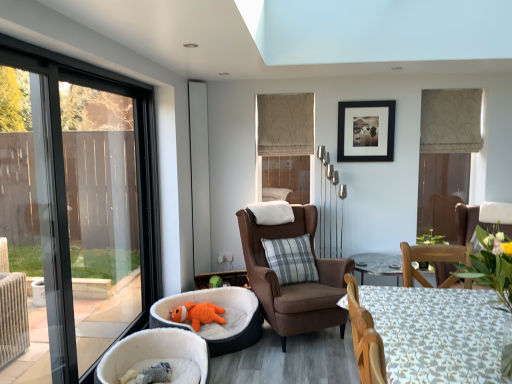
The width and height of the screenshot is (512, 384). I want to click on white plush pet bed at lower left, positioned as the 1th chair in left-to-right order, so click(x=157, y=355).

What do you see at coordinates (296, 283) in the screenshot? I see `brown fabric chair at center, placed as the 2th chair when sorted from front to back` at bounding box center [296, 283].

Measure the distance between plaid fabric pillow at center and camera.

The depth of plaid fabric pillow at center is 3.49 meters.

You are a GUI agent. You are given a task and a screenshot of the screen. Output one action in this format:
    pyautogui.click(x=<x>, y=<y>)
    Task: Click on the orange corduroy pet bed at lower left
    The height and width of the screenshot is (384, 512).
    Given the screenshot: What is the action you would take?
    pyautogui.click(x=221, y=315)

This screenshot has width=512, height=384. Identify the location of satin silver screen door at center. (199, 176).

What do you see at coordinates (366, 131) in the screenshot? I see `black matte picture frame at upper center` at bounding box center [366, 131].

Find the location of `orange plush toy at lower left`. orange plush toy at lower left is located at coordinates (198, 314).

What are the coordinates of `white plush pet bed at lower left, positioned as the 1th chair in left-to-right order` in the screenshot? It's located at (157, 355).

Is point (304, 216) closer to camera compared to point (262, 243)?

No, (304, 216) is further to viewer.

Which of these two, brown fabric chair at center, placed as the 2th chair when sorted from front to back, or plaid fabric pillow at center, is thinner?

plaid fabric pillow at center is thinner.

Can you confirm if brown fabric chair at center, which appears as the 1th chair when viewed from the back, is smaller than plaid fabric pillow at center?

Actually, brown fabric chair at center, which appears as the 1th chair when viewed from the back, might be larger than plaid fabric pillow at center.

Is satin silver screen door at center bigger than white plush pet bed at lower left, positioned as the 1th chair in left-to-right order?

Incorrect, satin silver screen door at center is not larger than white plush pet bed at lower left, positioned as the 1th chair in left-to-right order.

Is satin silver screen door at center thinner than white plush pet bed at lower left, placed as the 1th chair when sorted from front to back?

Indeed, satin silver screen door at center has a lesser width compared to white plush pet bed at lower left, placed as the 1th chair when sorted from front to back.

Is satin silver screen door at center looking in the opposite direction of white plush pet bed at lower left, which ranks as the 2th chair in back-to-front order?

No, satin silver screen door at center is not facing away from white plush pet bed at lower left, which ranks as the 2th chair in back-to-front order.

From the image's perspective, between satin silver screen door at center and white plush pet bed at lower left, placed as the 1th chair when sorted from front to back, who is located below?

From the image's view, white plush pet bed at lower left, placed as the 1th chair when sorted from front to back, is below.

Considering the sizes of objects orange corduroy pet bed at lower left and orange plush toy at lower left in the image provided, who is wider, orange corduroy pet bed at lower left or orange plush toy at lower left?

Wider between the two is orange corduroy pet bed at lower left.

Between point (253, 320) and point (192, 308), which one is positioned in front?

The point (253, 320) is in front.

Between orange corduroy pet bed at lower left and orange plush toy at lower left, which one has smaller size?

With smaller size is orange plush toy at lower left.

Does orange corduroy pet bed at lower left touch orange plush toy at lower left?

No.

Which is correct: plaid fabric pillow at center is inside orange plush toy at lower left, or outside of it?

plaid fabric pillow at center is not enclosed by orange plush toy at lower left.

Is point (306, 278) positioned before point (214, 319)?

That is False.

Between plaid fabric pillow at center and orange plush toy at lower left, which one appears on the right side from the viewer's perspective?

Positioned to the right is plaid fabric pillow at center.

From a real-world perspective, which object stands above the other?

plaid fabric pillow at center.

Is orange corduroy pet bed at lower left in front of or behind white plush pet bed at lower left, positioned as the 1th chair in left-to-right order, in the image?

orange corduroy pet bed at lower left is behind white plush pet bed at lower left, positioned as the 1th chair in left-to-right order.

Is point (252, 292) positioned before point (178, 376)?

No, (252, 292) is behind (178, 376).

What's the angular difference between orange corduroy pet bed at lower left and white plush pet bed at lower left, positioned as the 1th chair in left-to-right order,'s facing directions?

They differ by 45.9 degrees in their facing directions.

From a real-world perspective, is orange corduroy pet bed at lower left on white plush pet bed at lower left, which ranks as the 2th chair in back-to-front order?

Correct, in the physical world, orange corduroy pet bed at lower left is higher than white plush pet bed at lower left, which ranks as the 2th chair in back-to-front order.

From a real-world perspective, who is located higher, white plush pet bed at lower left, positioned as the 1th chair in left-to-right order, or orange corduroy pet bed at lower left?

orange corduroy pet bed at lower left, from a real-world perspective.

Can you tell me how much white plush pet bed at lower left, which ranks as the 2th chair in back-to-front order, and orange corduroy pet bed at lower left differ in facing direction?

white plush pet bed at lower left, which ranks as the 2th chair in back-to-front order, and orange corduroy pet bed at lower left are facing 45.9 degrees away from each other.

From the picture: Which object is positioned more to the right, white plush pet bed at lower left, positioned as the 1th chair in left-to-right order, or orange corduroy pet bed at lower left?

orange corduroy pet bed at lower left.

Identify the location of infant bed behind the white plush pet bed at lower left, the second chair when ordered from right to left. Image resolution: width=512 pixels, height=384 pixels. (221, 315).

In the scene shown: From the image's perspective, would you say orange plush toy at lower left is shown under white plush pet bed at lower left, which ranks as the 2th chair in back-to-front order?

No, from the image's perspective, orange plush toy at lower left is not beneath white plush pet bed at lower left, which ranks as the 2th chair in back-to-front order.

Which is more to the left, orange plush toy at lower left or white plush pet bed at lower left, which ranks as the 2th chair in back-to-front order?

white plush pet bed at lower left, which ranks as the 2th chair in back-to-front order, is more to the left.

Considering the sizes of orange plush toy at lower left and white plush pet bed at lower left, positioned as the 1th chair in left-to-right order, in the image, is orange plush toy at lower left taller or shorter than white plush pet bed at lower left, positioned as the 1th chair in left-to-right order,?

orange plush toy at lower left is shorter than white plush pet bed at lower left, positioned as the 1th chair in left-to-right order.

How different are the orientations of orange plush toy at lower left and white plush pet bed at lower left, placed as the 1th chair when sorted from front to back, in degrees?

The angle between the facing direction of orange plush toy at lower left and the facing direction of white plush pet bed at lower left, placed as the 1th chair when sorted from front to back, is 70.7 degrees.

Locate an element on the screen. This screenshot has height=384, width=512. pillow above the brown fabric chair at center, which appears as the 1th chair when viewed from the back (from a real-world perspective) is located at coordinates (291, 259).

The width and height of the screenshot is (512, 384). Identify the location of screen door on the right of white plush pet bed at lower left, the second chair when ordered from right to left. (199, 176).

Based on their spatial positions, is white plush pet bed at lower left, positioned as the 1th chair in left-to-right order, or brown fabric chair at center, which appears as the 1th chair when viewed from the back, closer to satin silver screen door at center?

brown fabric chair at center, which appears as the 1th chair when viewed from the back, lies closer to satin silver screen door at center than the other object.

When comparing their distances from plaid fabric pillow at center, does white fabric table at lower right or brown fabric chair at center, which appears as the 1th chair when viewed from the back, seem further?

white fabric table at lower right is positioned further to the anchor plaid fabric pillow at center.

Based on their spatial positions, is white plush pet bed at lower left, placed as the 1th chair when sorted from front to back, or orange plush toy at lower left closer to black matte picture frame at upper center?

orange plush toy at lower left.

From the image, which object appears to be farther from white fabric table at lower right, black matte picture frame at upper center or orange plush toy at lower left?

black matte picture frame at upper center is positioned further to the anchor white fabric table at lower right.

From the image, which object appears to be nearer to orange corduroy pet bed at lower left, satin silver screen door at center or orange plush toy at lower left?

orange plush toy at lower left.

Looking at the image, which one is located further to brown fabric chair at center, which appears as the 1th chair when viewed from the back, orange plush toy at lower left or plaid fabric pillow at center?

orange plush toy at lower left.

Considering their positions, is brown fabric chair at center, which appears as the second chair when viewed from the left, positioned further to satin silver screen door at center than orange plush toy at lower left?

brown fabric chair at center, which appears as the second chair when viewed from the left, lies further to satin silver screen door at center than the other object.

When comparing their distances from white fabric table at lower right, does brown fabric chair at center, which appears as the 1th chair when viewed from the back, or satin silver screen door at center seem closer?

Based on the image, brown fabric chair at center, which appears as the 1th chair when viewed from the back, appears to be nearer to white fabric table at lower right.

Where is `animal located between white fabric table at lower right and black matte picture frame at upper center in the depth direction`? The height and width of the screenshot is (384, 512). animal located between white fabric table at lower right and black matte picture frame at upper center in the depth direction is located at coordinates (198, 314).

Image resolution: width=512 pixels, height=384 pixels. Find the location of `infant bed between white plush pet bed at lower left, positioned as the 1th chair in left-to-right order, and orange plush toy at lower left, along the z-axis`. infant bed between white plush pet bed at lower left, positioned as the 1th chair in left-to-right order, and orange plush toy at lower left, along the z-axis is located at coordinates (221, 315).

Identify the location of infant bed between white plush pet bed at lower left, placed as the 1th chair when sorted from front to back, and white fabric table at lower right. This screenshot has height=384, width=512. (221, 315).

You are a GUI agent. You are given a task and a screenshot of the screen. Output one action in this format:
    pyautogui.click(x=<x>, y=<y>)
    Task: Click on the animal between white fabric table at lower right and satin silver screen door at center from front to back
    
    Given the screenshot: What is the action you would take?
    pyautogui.click(x=198, y=314)